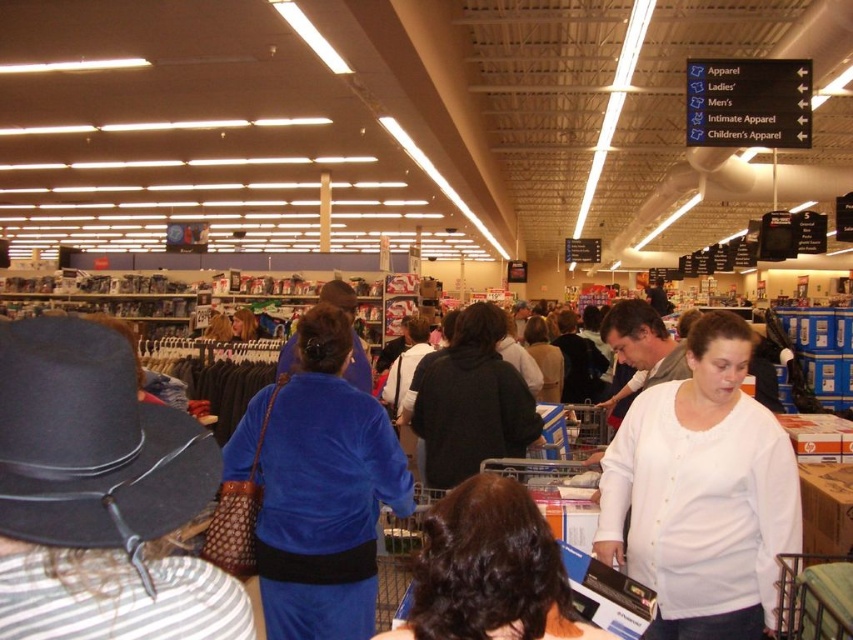
How much distance is there between dark gray hoodie at center and matte black shirt at center?

dark gray hoodie at center is 7.19 feet away from matte black shirt at center.

Where is `dark gray hoodie at center`? This screenshot has height=640, width=853. dark gray hoodie at center is located at coordinates (469, 401).

Does velvet blue dress at center appear on the right side of dark gray hoodie at center?

In fact, velvet blue dress at center is to the left of dark gray hoodie at center.

Which of these two, velvet blue dress at center or dark gray hoodie at center, stands shorter?

dark gray hoodie at center is shorter.

Where is `velvet blue dress at center`? velvet blue dress at center is located at coordinates (318, 488).

Where is `velvet blue dress at center`? Image resolution: width=853 pixels, height=640 pixels. velvet blue dress at center is located at coordinates (318, 488).

The image size is (853, 640). Identify the location of velvet blue dress at center. (318, 488).

Which is in front, point (357, 502) or point (486, 634)?

Point (486, 634)

Image resolution: width=853 pixels, height=640 pixels. In order to click on velvet blue dress at center in this screenshot , I will do `click(318, 488)`.